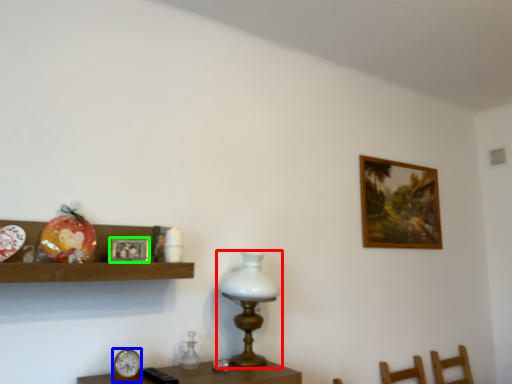
Question: Which object is the farthest from table lamp (highlighted by a red box)? Choose among these: clock (highlighted by a blue box) or picture frame (highlighted by a green box).

Choices:
 (A) clock
 (B) picture frame

Answer: (A)